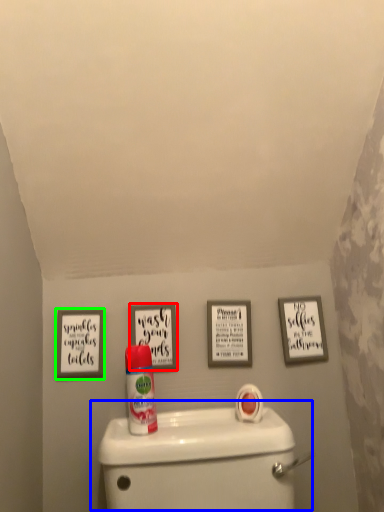
Question: Based on their relative distances, which object is nearer to picture frame (highlighted by a red box)? Choose from toilet (highlighted by a blue box) and picture frame (highlighted by a green box).

Choices:
 (A) toilet
 (B) picture frame

Answer: (B)